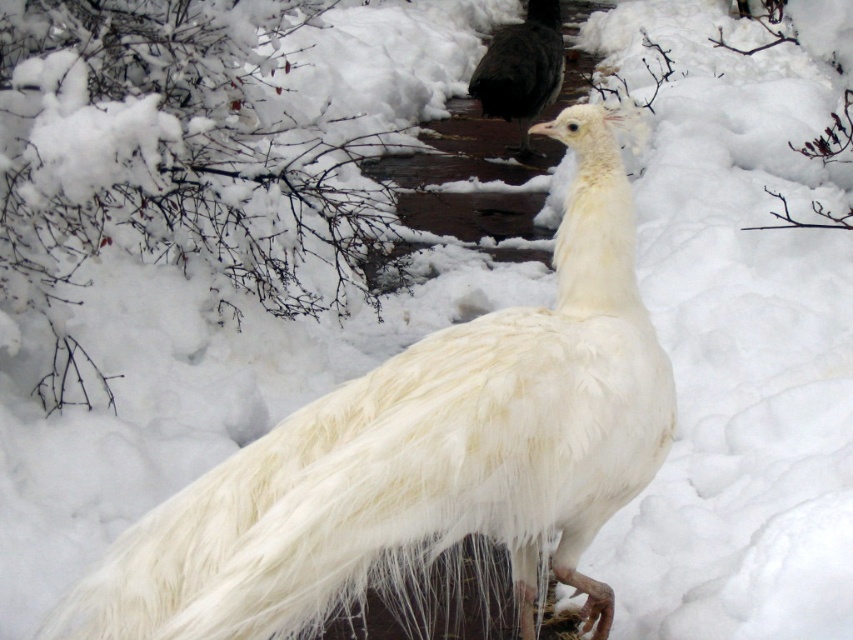
Question: Which point appears farthest from the camera in this image?

Choices:
 (A) (482, 394)
 (B) (547, 36)

Answer: (B)

Question: Can you confirm if white feathered peacock at center is wider than black glossy bird at center?

Choices:
 (A) yes
 (B) no

Answer: (A)

Question: Can you confirm if white feathered peacock at center is positioned above black glossy bird at center?

Choices:
 (A) no
 (B) yes

Answer: (A)

Question: Which point is farther from the camera taking this photo?

Choices:
 (A) (363, 483)
 (B) (532, 1)

Answer: (B)

Question: Is white feathered peacock at center to the right of black glossy bird at center from the viewer's perspective?

Choices:
 (A) yes
 (B) no

Answer: (B)